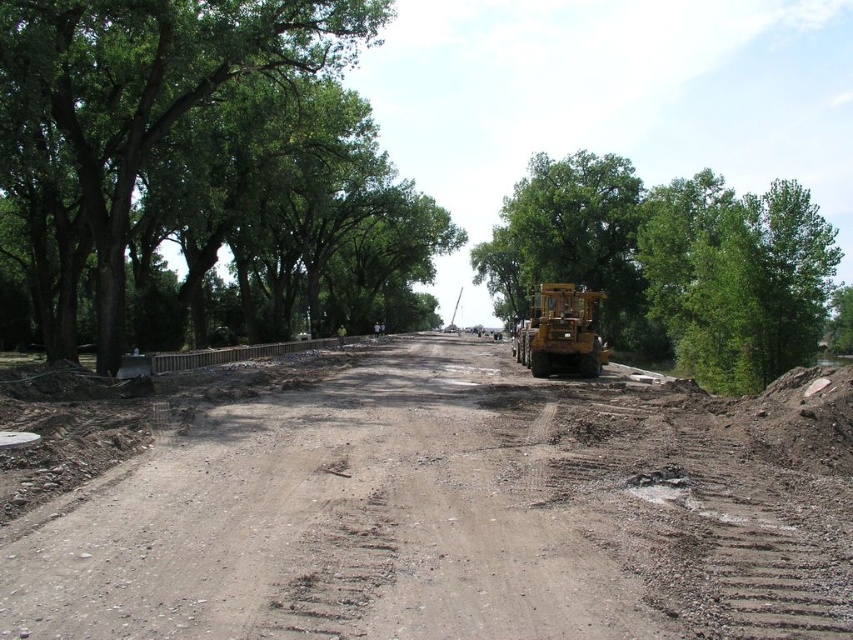
You are a delivery driver approaching this construction site. You need to navigate around the yellow construction vehicle on the right and the temporary barrier on the left. Which object, the brown dirt track at center or the green leafy tree at center, is positioned to the left side of the other?

The brown dirt track at center is to the left of the green leafy tree at center according to the description.

Based on the photo, you are a delivery driver trying to navigate through the construction site. You see the brown dirt track at center and the yellow rubber excavator at center. Which path should you take to avoid the excavator?

The brown dirt track at center is positioned on the left side of the yellow rubber excavator at center, so you should take the path on the right side of the excavator to avoid it.